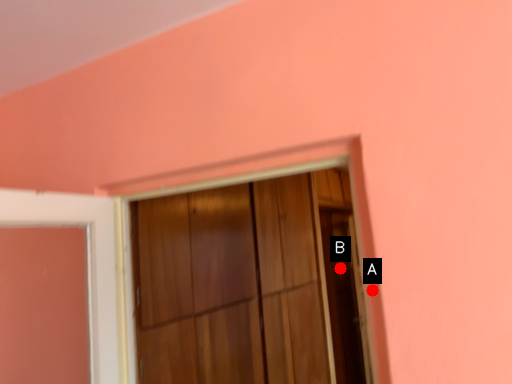
Question: Two points are circled on the image, labeled by A and B beside each circle. Which of the following is the closest to the observer?

Choices:
 (A) A is closer
 (B) B is closer

Answer: (A)